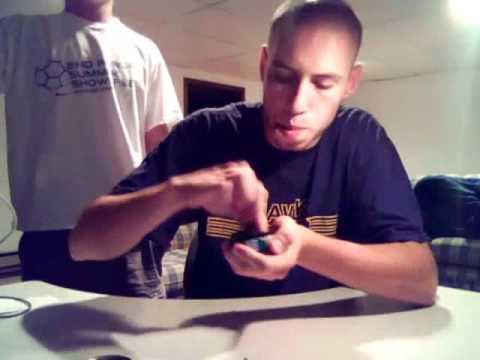
Where is `off white wall`? off white wall is located at coordinates (435, 129).